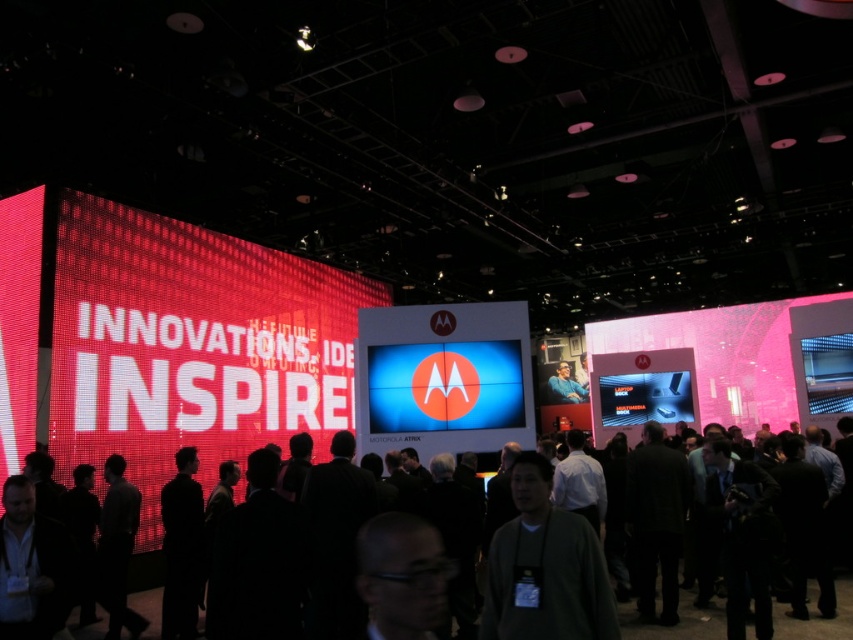
You are an event photographer at the trade show. You need to capture a clear photo of the metallic silver phone at center without the dark gray sweater at center blocking it. Can you adjust your camera angle to achieve this?

The dark gray sweater at center has a smaller size compared to metallic silver phone at center, so adjusting the camera angle might not be sufficient to avoid the sweater blocking the phone. The sweater is smaller, so it might be easier to move slightly to the side or adjust the framing to exclude the sweater while keeping the phone in focus.

You are a photographer at the event and want to capture both the black fabric crowd at center and the metallic silver phone at center in a single frame. Which object occupies more horizontal space in the image?

The black fabric crowd at center occupies more horizontal space than the metallic silver phone at center because its width surpasses that of the phone.